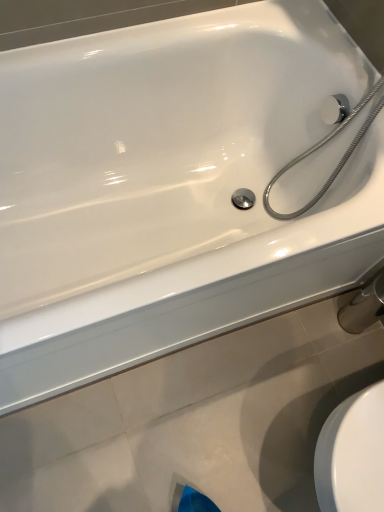
Question: Looking at the image, does chrome metallic shower head at upper right seem bigger or smaller compared to chrome metallic faucet at lower right?

Choices:
 (A) big
 (B) small

Answer: (A)

Question: Considering the positions of chrome metallic shower head at upper right and chrome metallic faucet at lower right in the image, is chrome metallic shower head at upper right wider or thinner than chrome metallic faucet at lower right?

Choices:
 (A) thin
 (B) wide

Answer: (B)

Question: From the image's perspective, is chrome metallic shower head at upper right located above or below chrome metallic faucet at lower right?

Choices:
 (A) below
 (B) above

Answer: (B)

Question: Is chrome metallic faucet at lower right spatially inside chrome metallic shower head at upper right, or outside of it?

Choices:
 (A) inside
 (B) outside

Answer: (B)

Question: In the image, is chrome metallic faucet at lower right on the left side or the right side of chrome metallic shower head at upper right?

Choices:
 (A) right
 (B) left

Answer: (A)

Question: From their relative heights in the image, would you say chrome metallic faucet at lower right is taller or shorter than chrome metallic shower head at upper right?

Choices:
 (A) tall
 (B) short

Answer: (B)

Question: Looking at their shapes, would you say chrome metallic faucet at lower right is wider or thinner than chrome metallic shower head at upper right?

Choices:
 (A) wide
 (B) thin

Answer: (B)